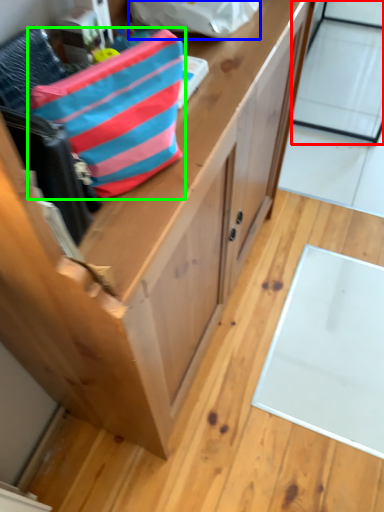
Question: Considering the real-world distances, which object is farthest from glass door (highlighted by a red box)? pouch (highlighted by a blue box) or pouch (highlighted by a green box)?

Choices:
 (A) pouch
 (B) pouch

Answer: (B)